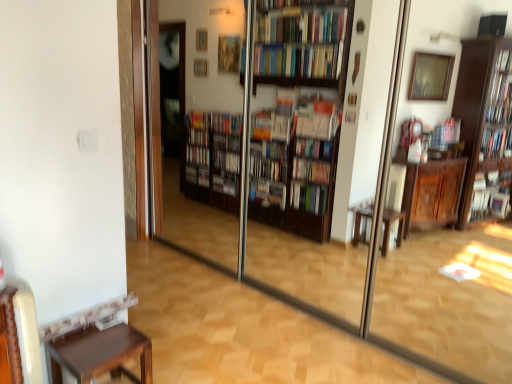
Question: Can you confirm if brown wood stool at lower left is smaller than transparent glass screen door at center?

Choices:
 (A) no
 (B) yes

Answer: (B)

Question: From the image's perspective, is brown wood stool at lower left beneath transparent glass screen door at center?

Choices:
 (A) no
 (B) yes

Answer: (B)

Question: Can we say brown wood stool at lower left lies outside transparent glass screen door at center?

Choices:
 (A) yes
 (B) no

Answer: (A)

Question: Are brown wood stool at lower left and transparent glass screen door at center located far from each other?

Choices:
 (A) no
 (B) yes

Answer: (B)

Question: Is brown wood stool at lower left with transparent glass screen door at center?

Choices:
 (A) yes
 (B) no

Answer: (B)

Question: Is transparent glass screen door at center a part of brown wood stool at lower left?

Choices:
 (A) no
 (B) yes

Answer: (A)

Question: Does transparent glass screen door at center have a greater width compared to brown wood stool at lower left?

Choices:
 (A) no
 (B) yes

Answer: (A)

Question: Would you say transparent glass screen door at center is outside brown wood stool at lower left?

Choices:
 (A) no
 (B) yes

Answer: (B)

Question: Considering the relative positions of transparent glass screen door at center and brown wood stool at lower left in the image provided, is transparent glass screen door at center to the left of brown wood stool at lower left from the viewer's perspective?

Choices:
 (A) yes
 (B) no

Answer: (B)

Question: Can you confirm if transparent glass screen door at center is thinner than brown wood stool at lower left?

Choices:
 (A) yes
 (B) no

Answer: (A)

Question: Is transparent glass screen door at center with brown wood stool at lower left?

Choices:
 (A) yes
 (B) no

Answer: (B)

Question: Does transparent glass screen door at center turn towards brown wood stool at lower left?

Choices:
 (A) yes
 (B) no

Answer: (A)

Question: Based on their sizes in the image, would you say brown wood stool at lower left is bigger or smaller than transparent glass screen door at center?

Choices:
 (A) big
 (B) small

Answer: (B)